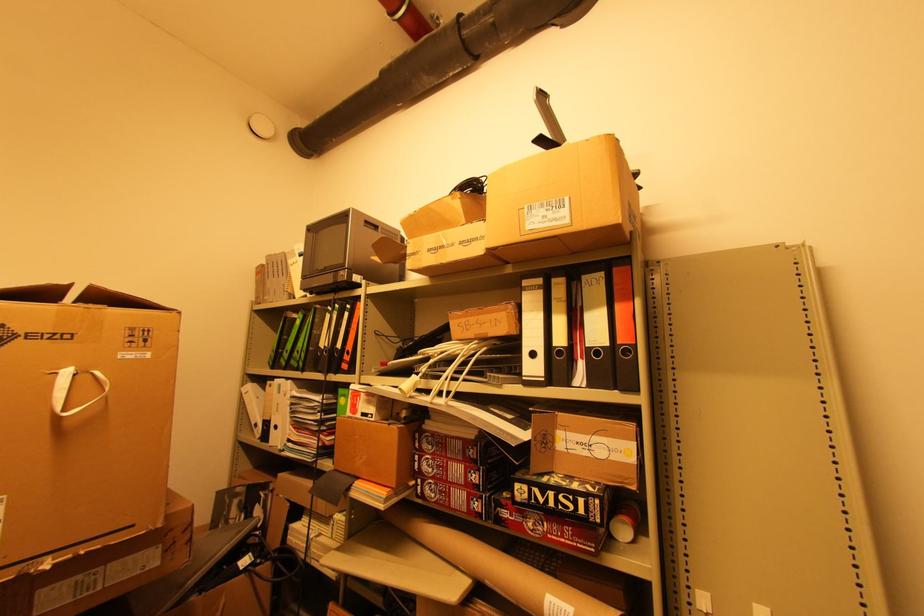
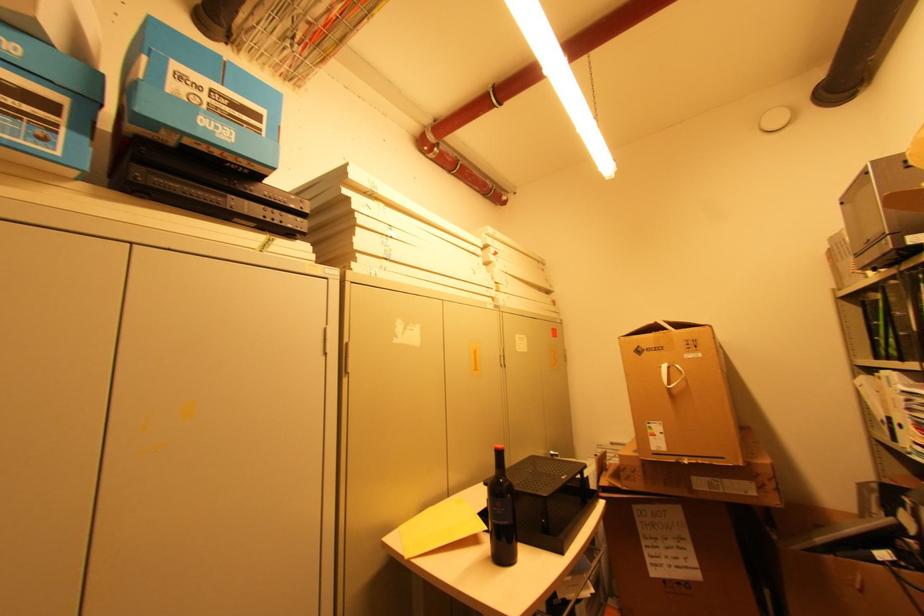
Locate, in the second image, the point that corresponds to the point at 319,329 in the first image.

(896, 310)